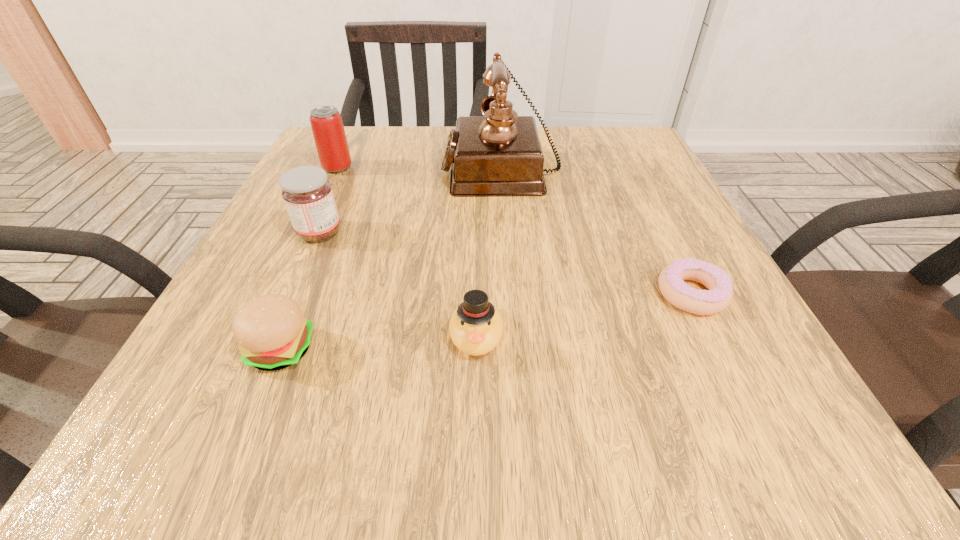
Where is `the tallest object`? the tallest object is located at coordinates (499, 154).

You are a GUI agent. You are given a task and a screenshot of the screen. Output one action in this format:
    pyautogui.click(x=<x>, y=<y>)
    Task: Click on the beer can
    The width and height of the screenshot is (960, 540).
    Given the screenshot: What is the action you would take?
    pyautogui.click(x=327, y=126)

Locate an element on the screen. the fourth nearest object is located at coordinates (308, 196).

This screenshot has width=960, height=540. Find the location of `duck`. duck is located at coordinates (476, 327).

This screenshot has width=960, height=540. In order to click on the fifth tallest object in this screenshot , I will do `click(272, 334)`.

What are the coordinates of `the rightmost object` in the screenshot? It's located at (671, 279).

Where is `doughnut`? The image size is (960, 540). doughnut is located at coordinates [x=671, y=279].

Identify the location of vacant space located on the dial of the telephone. The image size is (960, 540). (341, 167).

Where is `free point located on the dial of the telephone`? free point located on the dial of the telephone is located at coordinates (317, 167).

The height and width of the screenshot is (540, 960). I want to click on free space located on the dial of the telephone, so click(x=387, y=167).